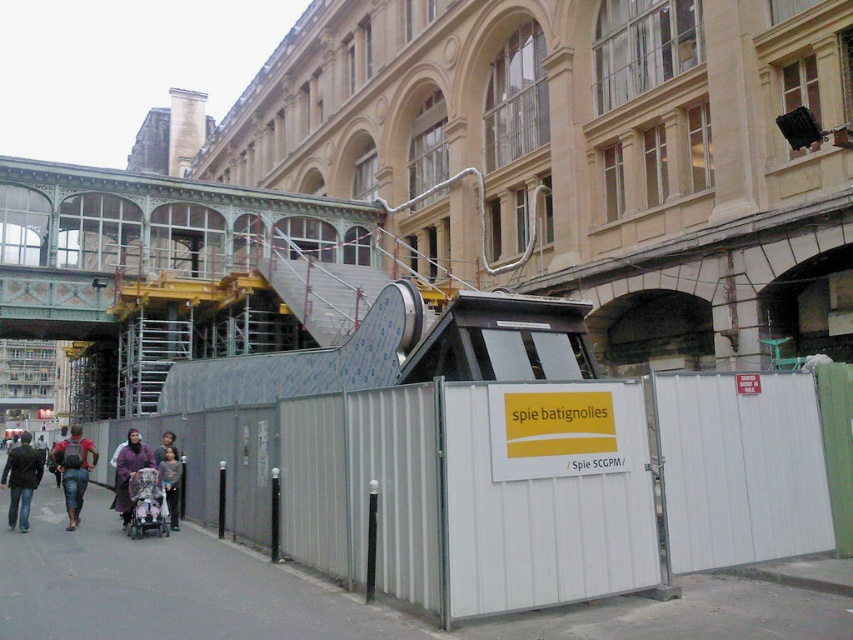
Who is positioned more to the right, dark brown leather jacket at lower left or reddish-brown backpack at left?

From the viewer's perspective, reddish-brown backpack at left appears more on the right side.

How much distance is there between dark brown leather jacket at lower left and reddish-brown backpack at left?

5.83 meters

Which is behind, point (44, 456) or point (77, 422)?

The point (77, 422) is behind.

You are a GUI agent. You are given a task and a screenshot of the screen. Output one action in this format:
    pyautogui.click(x=<x>, y=<y>)
    Task: Click on the dark brown leather jacket at lower left
    The width and height of the screenshot is (853, 640).
    Given the screenshot: What is the action you would take?
    pyautogui.click(x=21, y=480)

Between white metal fence at lower center and light brown fabric baby stroller at lower center, which one has less height?

With less height is light brown fabric baby stroller at lower center.

Who is taller, white metal fence at lower center or light brown fabric baby stroller at lower center?

white metal fence at lower center is taller.

Describe the element at coordinates (535, 483) in the screenshot. I see `white metal fence at lower center` at that location.

Image resolution: width=853 pixels, height=640 pixels. I want to click on white metal fence at lower center, so click(x=535, y=483).

Who is shorter, white metal fence at lower center or dark brown leather jacket at lower left?

With less height is white metal fence at lower center.

Is the position of white metal fence at lower center more distant than that of dark brown leather jacket at lower left?

No, it is in front of dark brown leather jacket at lower left.

Find the location of `white metal fence at lower center`. white metal fence at lower center is located at coordinates (535, 483).